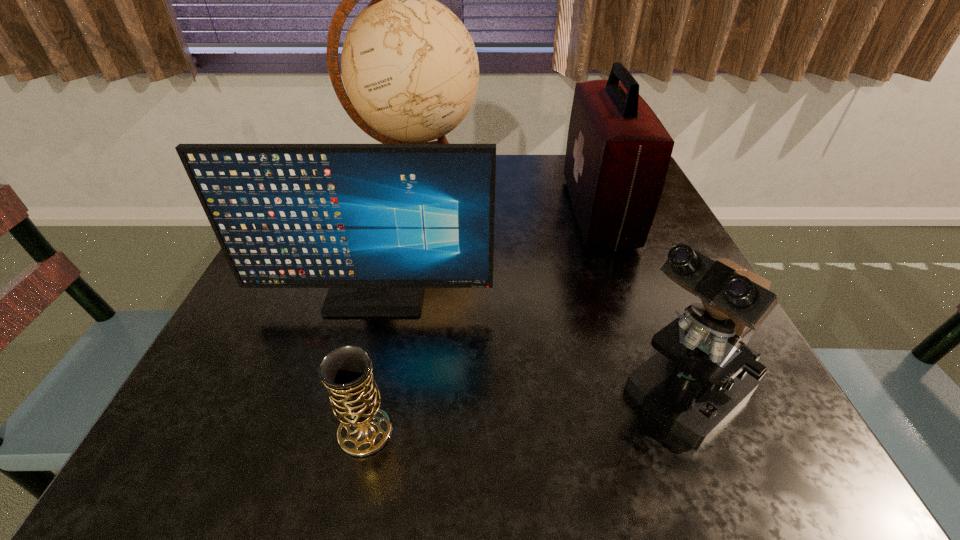
The width and height of the screenshot is (960, 540). Identify the location of free space located 0.050m on the left of the microscope. (574, 394).

Identify the location of free space located 0.140m on the right of the chalice. The height and width of the screenshot is (540, 960). (497, 431).

I want to click on globe at the far edge, so click(x=410, y=68).

Image resolution: width=960 pixels, height=540 pixels. I want to click on the first aid kit located at the far edge, so click(x=618, y=152).

I want to click on microscope present at the near edge, so click(x=704, y=370).

Identify the location of chalice at the near edge. (346, 371).

The image size is (960, 540). I want to click on globe located in the left edge section of the desktop, so click(410, 68).

Where is `computer monitor located at the left edge`? computer monitor located at the left edge is located at coordinates (375, 223).

Where is `the first aid kit located in the right edge section of the desktop`? The image size is (960, 540). the first aid kit located in the right edge section of the desktop is located at coordinates (618, 152).

Locate an element on the screen. Image resolution: width=960 pixels, height=540 pixels. microscope that is at the right edge is located at coordinates (704, 370).